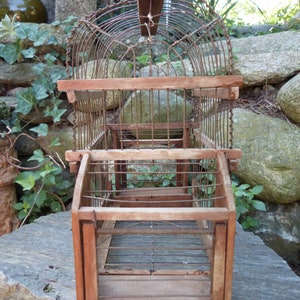
Find the location of a particular element. The height and width of the screenshot is (300, 300). grey table is located at coordinates tap(50, 264).